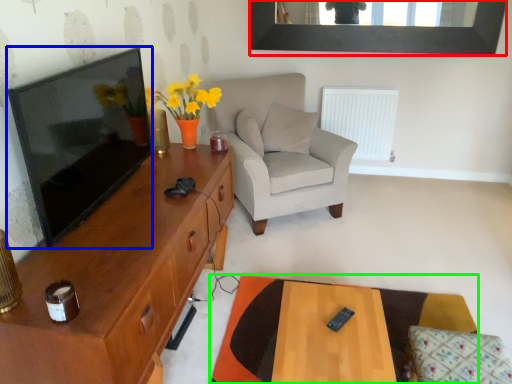
Question: Estimate the real-world distances between objects in this image. Which object is farther from picture frame (highlighted by a red box), television (highlighted by a blue box) or desk (highlighted by a green box)?

Choices:
 (A) television
 (B) desk

Answer: (B)